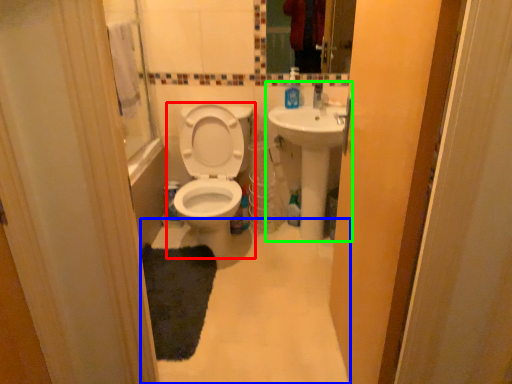
Question: Which object is positioned closest to toilet (highlighted by a red box)? Select from plain (highlighted by a blue box) and sink (highlighted by a green box).

Choices:
 (A) plain
 (B) sink

Answer: (B)